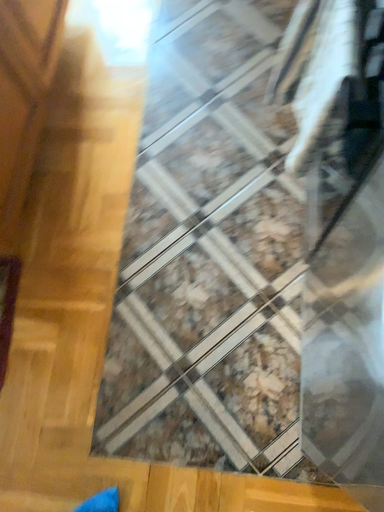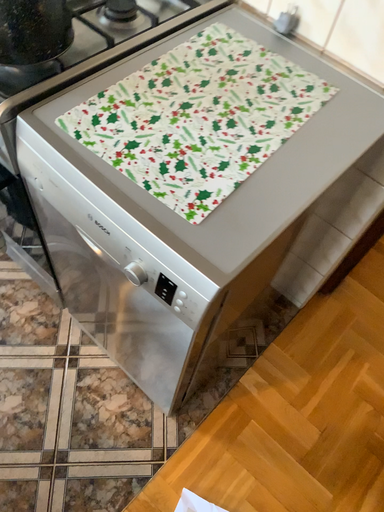
Question: Which way did the camera rotate in the video?

Choices:
 (A) rotated right
 (B) rotated left

Answer: (A)